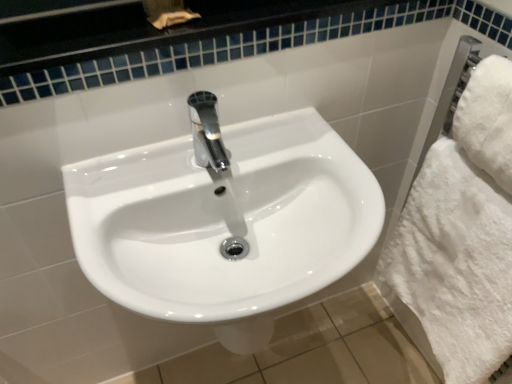
Question: Is white fluffy towel at right, which appears as the first bath towel when viewed from the top, wider than white glossy sink at center?

Choices:
 (A) no
 (B) yes

Answer: (A)

Question: Is the depth of white fluffy towel at right, which is the second bath towel in bottom-to-top order, less than that of white glossy sink at center?

Choices:
 (A) no
 (B) yes

Answer: (A)

Question: From the image's perspective, is white fluffy towel at right, which is the second bath towel in bottom-to-top order, on top of white glossy sink at center?

Choices:
 (A) no
 (B) yes

Answer: (B)

Question: Can we say white fluffy towel at right, which is the second bath towel in bottom-to-top order, lies outside white glossy sink at center?

Choices:
 (A) yes
 (B) no

Answer: (A)

Question: Looking at the image, does white fluffy towel at right, which is the second bath towel in bottom-to-top order, seem bigger or smaller compared to white fluffy bath towel at right, the 2th bath towel when ordered from top to bottom?

Choices:
 (A) small
 (B) big

Answer: (A)

Question: From the image's perspective, is white fluffy towel at right, which appears as the first bath towel when viewed from the top, located above or below white fluffy bath towel at right, the 2th bath towel when ordered from top to bottom?

Choices:
 (A) below
 (B) above

Answer: (B)

Question: Is white fluffy towel at right, which is the second bath towel in bottom-to-top order, wider or thinner than white fluffy bath towel at right, the 2th bath towel when ordered from top to bottom?

Choices:
 (A) thin
 (B) wide

Answer: (A)

Question: Choose the correct answer: Is white fluffy towel at right, which appears as the first bath towel when viewed from the top, inside white fluffy bath towel at right, the 2th bath towel when ordered from top to bottom, or outside it?

Choices:
 (A) inside
 (B) outside

Answer: (B)

Question: From the image's perspective, is white fluffy bath towel at right, which is the first bath towel from bottom to top, positioned above or below white glossy sink at center?

Choices:
 (A) above
 (B) below

Answer: (B)

Question: Which is correct: white fluffy bath towel at right, which is the first bath towel from bottom to top, is inside white glossy sink at center, or outside of it?

Choices:
 (A) outside
 (B) inside

Answer: (A)

Question: From a real-world perspective, is white fluffy bath towel at right, which is the first bath towel from bottom to top, above or below white glossy sink at center?

Choices:
 (A) above
 (B) below

Answer: (B)

Question: Is point (450, 331) positioned closer to the camera than point (330, 130)?

Choices:
 (A) farther
 (B) closer

Answer: (A)

Question: Is white glossy sink at center bigger or smaller than white fluffy bath towel at right, the 2th bath towel when ordered from top to bottom?

Choices:
 (A) small
 (B) big

Answer: (B)

Question: In terms of height, does white glossy sink at center look taller or shorter compared to white fluffy bath towel at right, which is the first bath towel from bottom to top?

Choices:
 (A) short
 (B) tall

Answer: (A)